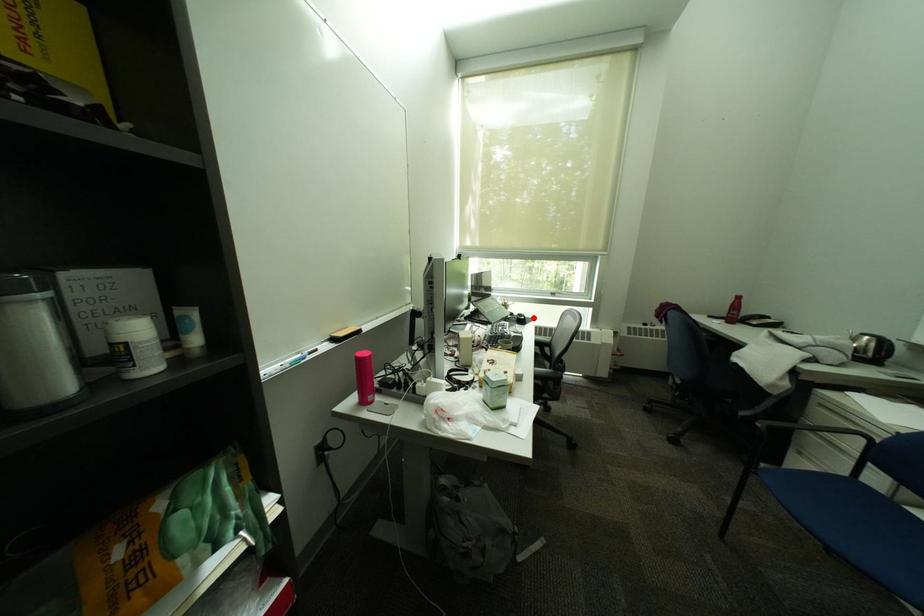
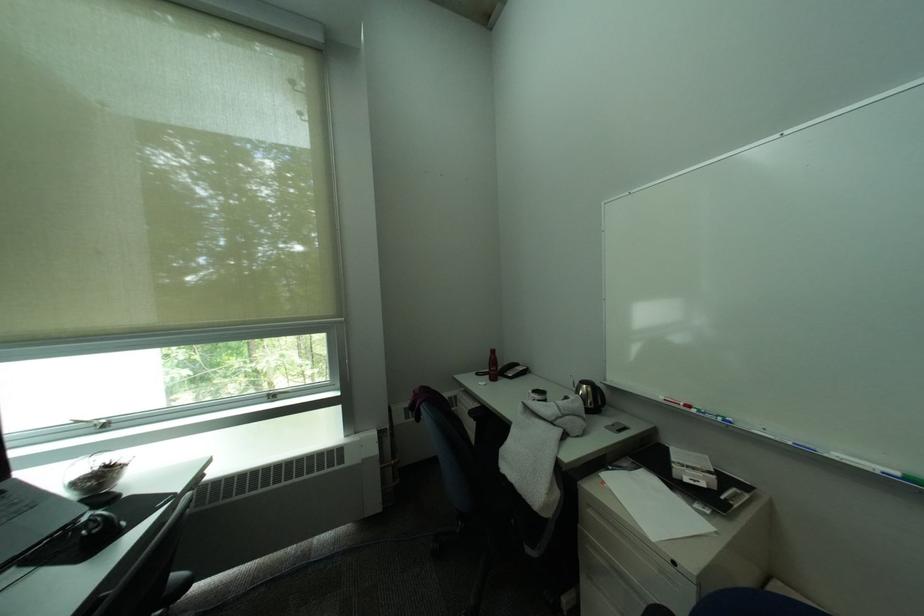
The point at the highlighted location is marked in the first image. Where is the corresponding point in the second image?

(106, 528)